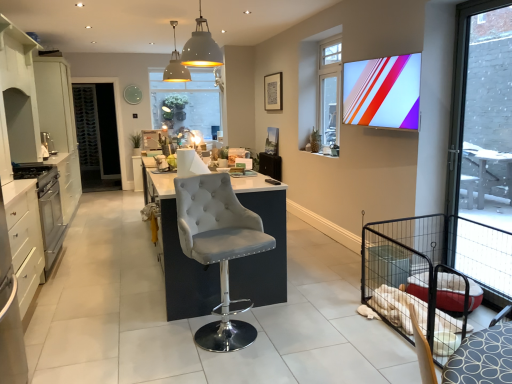
Question: From a real-world perspective, does matte white dome at center, placed as the 1th light fixture when sorted from left to right, sit lower than translucent glass window at center, which ranks as the first window in back-to-front order?

Choices:
 (A) no
 (B) yes

Answer: (A)

Question: Is matte white dome at center, which is the second light fixture in right-to-left order, not within translucent glass window at center, the third window viewed from the front?

Choices:
 (A) no
 (B) yes

Answer: (B)

Question: Is translucent glass window at center, which ranks as the first window in back-to-front order, located within matte white dome at center, which is the second light fixture in right-to-left order?

Choices:
 (A) no
 (B) yes

Answer: (A)

Question: Does matte white dome at center, the second light fixture viewed from the front, lie in front of translucent glass window at center, the third window viewed from the front?

Choices:
 (A) no
 (B) yes

Answer: (B)

Question: Is matte white dome at center, the second light fixture viewed from the front, oriented towards translucent glass window at center, the third window viewed from the front?

Choices:
 (A) yes
 (B) no

Answer: (B)

Question: Can you confirm if matte white dome at center, placed as the 1th light fixture when sorted from left to right, is bigger than translucent glass window at center, acting as the first window starting from the left?

Choices:
 (A) yes
 (B) no

Answer: (B)

Question: Does satin silver oven at left, placed as the third appliance when sorted from back to front, have a greater width compared to matte white dome at center, arranged as the first light fixture when viewed from the back?

Choices:
 (A) no
 (B) yes

Answer: (B)

Question: Is satin silver oven at left, the second appliance viewed from the top, at the right side of matte white dome at center, which is the second light fixture in right-to-left order?

Choices:
 (A) no
 (B) yes

Answer: (A)

Question: Does satin silver oven at left, arranged as the 1th appliance when viewed from the front, have a lesser width compared to matte white dome at center, placed as the 1th light fixture when sorted from left to right?

Choices:
 (A) yes
 (B) no

Answer: (B)

Question: Is satin silver oven at left, arranged as the 1th appliance when viewed from the front, positioned behind matte white dome at center, which is the second light fixture in right-to-left order?

Choices:
 (A) yes
 (B) no

Answer: (B)

Question: Is satin silver oven at left, the second appliance in the bottom-to-top sequence, touching matte white dome at center, arranged as the first light fixture when viewed from the back?

Choices:
 (A) yes
 (B) no

Answer: (B)

Question: Considering the relative sizes of satin silver oven at left, placed as the third appliance when sorted from back to front, and matte white dome at center, placed as the 1th light fixture when sorted from left to right, in the image provided, is satin silver oven at left, placed as the third appliance when sorted from back to front, bigger than matte white dome at center, placed as the 1th light fixture when sorted from left to right,?

Choices:
 (A) no
 (B) yes

Answer: (A)

Question: Does matte plastic tv at upper right contain satin silver oven at left, the second appliance in the bottom-to-top sequence?

Choices:
 (A) no
 (B) yes

Answer: (A)